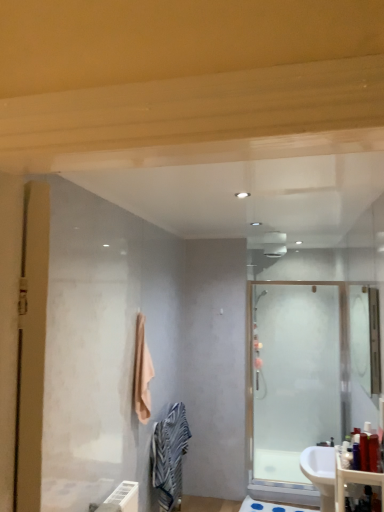
Locate an element on the screen. Image resolution: width=384 pixels, height=512 pixels. beige cotton towel at center-left, the second bath towel in the back-to-front sequence is located at coordinates (142, 373).

Describe the element at coordinates (296, 384) in the screenshot. I see `frosted glass shower door at right` at that location.

Locate an element on the screen. The width and height of the screenshot is (384, 512). blue rubber bath mat at lower center is located at coordinates (269, 507).

This screenshot has width=384, height=512. What do you see at coordinates (169, 456) in the screenshot?
I see `striped cotton bath towel at lower center, the second bath towel in the top-to-bottom sequence` at bounding box center [169, 456].

The width and height of the screenshot is (384, 512). What are the coordinates of `striped cotton bath towel at lower center, marked as the 1th bath towel in a bottom-to-top arrangement` in the screenshot? It's located at (169, 456).

The image size is (384, 512). I want to click on beige cotton towel at center-left, the 1th bath towel in the top-to-bottom sequence, so click(142, 373).

From the image's perspective, which one is positioned higher, striped cotton bath towel at lower center, the second bath towel in the top-to-bottom sequence, or white glossy sink at lower right?

From the image's view, white glossy sink at lower right is above.

Is striped cotton bath towel at lower center, which is the second bath towel from front to back, aimed at white glossy sink at lower right?

Yes, striped cotton bath towel at lower center, which is the second bath towel from front to back, is facing white glossy sink at lower right.

Considering the sizes of objects striped cotton bath towel at lower center, which is the second bath towel from front to back, and white glossy sink at lower right in the image provided, who is smaller, striped cotton bath towel at lower center, which is the second bath towel from front to back, or white glossy sink at lower right?

striped cotton bath towel at lower center, which is the second bath towel from front to back.

Considering the relative positions of striped cotton bath towel at lower center, placed as the 1th bath towel when sorted from back to front, and white glossy sink at lower right in the image provided, is striped cotton bath towel at lower center, placed as the 1th bath towel when sorted from back to front, to the left or to the right of white glossy sink at lower right?

Based on their positions, striped cotton bath towel at lower center, placed as the 1th bath towel when sorted from back to front, is located to the left of white glossy sink at lower right.

Is point (341, 462) closer or farther from the camera than point (376, 459)?

Clearly, point (341, 462) is more distant from the camera than point (376, 459).

Is translucent plastic bottle at lower right, which is the fourth toiletry from right to left, aimed at translucent plastic bottle at lower right, the first toiletry viewed from the right?

No, translucent plastic bottle at lower right, which is the fourth toiletry from right to left, is not aimed at translucent plastic bottle at lower right, the first toiletry viewed from the right.

Who is taller, translucent plastic bottle at lower right, the first toiletry viewed from the left, or translucent plastic bottle at lower right, the fourth toiletry from the left?

translucent plastic bottle at lower right, the fourth toiletry from the left.

How many degrees apart are the facing directions of translucent plastic bottle at lower right, which is the fourth toiletry from right to left, and translucent plastic bottle at lower right, the fourth toiletry from the left?

The angle between the facing direction of translucent plastic bottle at lower right, which is the fourth toiletry from right to left, and the facing direction of translucent plastic bottle at lower right, the fourth toiletry from the left, is 2.13 degrees.

Is white glossy sink at lower right taller or shorter than matte plastic counter top at lower right?

In the image, white glossy sink at lower right appears to be taller than matte plastic counter top at lower right.

Is the depth of white glossy sink at lower right less than that of matte plastic counter top at lower right?

No, it is behind matte plastic counter top at lower right.

Is point (320, 478) closer or farther from the camera than point (335, 477)?

Point (320, 478) is farther from the camera than point (335, 477).

Choose the correct answer: Is white glossy sink at lower right inside matte plastic counter top at lower right or outside it?

white glossy sink at lower right is not inside matte plastic counter top at lower right, it's outside.

From the picture: Which object is closer to the camera taking this photo, translucent plastic bottle at lower right, the fourth toiletry from the left, or clear glass mirror at upper right?

Positioned in front is translucent plastic bottle at lower right, the fourth toiletry from the left.

From the image's perspective, between translucent plastic bottle at lower right, the fourth toiletry from the left, and clear glass mirror at upper right, who is located below?

translucent plastic bottle at lower right, the fourth toiletry from the left, from the image's perspective.

Considering the positions of points (370, 453) and (379, 347), is point (370, 453) closer to camera compared to point (379, 347)?

Yes.

Are translucent plastic bottle at lower right, the first toiletry viewed from the right, and clear glass mirror at upper right making contact?

No, translucent plastic bottle at lower right, the first toiletry viewed from the right, is not with clear glass mirror at upper right.

What are the coordinates of `bath towel directly beneath the translucent plastic bottle at right, which appears as the third toiletry when viewed from the right (from a real-world perspective)` in the screenshot? It's located at (169, 456).

From a real-world perspective, relative to translucent plastic bottle at right, the 2th toiletry positioned from the left, is striped cotton bath towel at lower center, marked as the 1th bath towel in a bottom-to-top arrangement, vertically above or below?

striped cotton bath towel at lower center, marked as the 1th bath towel in a bottom-to-top arrangement, is below translucent plastic bottle at right, the 2th toiletry positioned from the left.

Does striped cotton bath towel at lower center, placed as the 1th bath towel when sorted from back to front, turn towards translucent plastic bottle at right, which appears as the third toiletry when viewed from the right?

No, striped cotton bath towel at lower center, placed as the 1th bath towel when sorted from back to front, is not aimed at translucent plastic bottle at right, which appears as the third toiletry when viewed from the right.

Is striped cotton bath towel at lower center, which is the second bath towel from front to back, in front of or behind translucent plastic bottle at right, which appears as the third toiletry when viewed from the right, in the image?

striped cotton bath towel at lower center, which is the second bath towel from front to back, is behind translucent plastic bottle at right, which appears as the third toiletry when viewed from the right.

Based on the photo, could you measure the distance between frosted glass shower door at right and beige cotton towel at center-left, the second bath towel in the back-to-front sequence?

They are 1.91 meters apart.

From the image's perspective, is frosted glass shower door at right above or below beige cotton towel at center-left, the second bath towel in the back-to-front sequence?

frosted glass shower door at right is situated lower than beige cotton towel at center-left, the second bath towel in the back-to-front sequence, in the image.

Considering the points (262, 411) and (136, 376), which point is in front, point (262, 411) or point (136, 376)?

The point (136, 376) is closer to the camera.

What's the angular difference between frosted glass shower door at right and beige cotton towel at center-left, the first bath towel from the front,'s facing directions?

95.1 degrees separate the facing orientations of frosted glass shower door at right and beige cotton towel at center-left, the first bath towel from the front.

Is translucent plastic bottle at lower right, the first toiletry viewed from the left, outside of translucent plastic bottle at right, which ranks as the 2th toiletry in right-to-left order?

Yes, translucent plastic bottle at lower right, the first toiletry viewed from the left, is not within translucent plastic bottle at right, which ranks as the 2th toiletry in right-to-left order.

Consider the image. Which of these two, translucent plastic bottle at lower right, the first toiletry viewed from the left, or translucent plastic bottle at right, which ranks as the 2th toiletry in right-to-left order, is thinner?

Thinner between the two is translucent plastic bottle at right, which ranks as the 2th toiletry in right-to-left order.

From a real-world perspective, is translucent plastic bottle at lower right, which is the fourth toiletry from right to left, located higher than translucent plastic bottle at right, the third toiletry viewed from the left?

No, from a real-world perspective, translucent plastic bottle at lower right, which is the fourth toiletry from right to left, is not over translucent plastic bottle at right, the third toiletry viewed from the left

Considering the relative sizes of translucent plastic bottle at lower right, which is the fourth toiletry from right to left, and translucent plastic bottle at right, which ranks as the 2th toiletry in right-to-left order, in the image provided, is translucent plastic bottle at lower right, which is the fourth toiletry from right to left, bigger than translucent plastic bottle at right, which ranks as the 2th toiletry in right-to-left order,?

Actually, translucent plastic bottle at lower right, which is the fourth toiletry from right to left, might be smaller than translucent plastic bottle at right, which ranks as the 2th toiletry in right-to-left order.

Starting from the white glossy sink at lower right, which bath towel is the 1st one to the left? Please provide its 2D coordinates.

[(169, 456)]

Which toiletry is the 3rd one when counting from the right side of the translucent plastic bottle at lower right, which is the fourth toiletry from right to left? Please provide its 2D coordinates.

[(373, 452)]

Based on their spatial positions, is clear glass mirror at upper right or striped cotton bath towel at lower center, placed as the 1th bath towel when sorted from back to front, further from matte plastic counter top at lower right?

The object further to matte plastic counter top at lower right is clear glass mirror at upper right.

Looking at the image, which one is located closer to striped cotton bath towel at lower center, placed as the 1th bath towel when sorted from back to front, translucent plastic bottle at lower right, the fourth toiletry from the left, or matte plastic counter top at lower right?

The object closer to striped cotton bath towel at lower center, placed as the 1th bath towel when sorted from back to front, is matte plastic counter top at lower right.

Which object lies further to the anchor point translucent plastic bottle at right, the 2th toiletry positioned from the left, striped cotton bath towel at lower center, placed as the 1th bath towel when sorted from back to front, or translucent plastic bottle at lower right, the first toiletry viewed from the left?

striped cotton bath towel at lower center, placed as the 1th bath towel when sorted from back to front, is positioned further to the anchor translucent plastic bottle at right, the 2th toiletry positioned from the left.

Considering their positions, is clear glass mirror at upper right positioned further to translucent plastic bottle at right, which ranks as the 2th toiletry in right-to-left order, than blue rubber bath mat at lower center?

clear glass mirror at upper right is further to translucent plastic bottle at right, which ranks as the 2th toiletry in right-to-left order.

When comparing their distances from blue rubber bath mat at lower center, does beige cotton towel at center-left, the first bath towel from the front, or matte plastic counter top at lower right seem closer?

Among the two, beige cotton towel at center-left, the first bath towel from the front, is located nearer to blue rubber bath mat at lower center.

Based on the photo, based on their spatial positions, is white glossy sink at lower right or translucent plastic bottle at right, which ranks as the 2th toiletry in right-to-left order, closer to translucent plastic bottle at lower right, the first toiletry viewed from the left?

Based on the image, translucent plastic bottle at right, which ranks as the 2th toiletry in right-to-left order, appears to be nearer to translucent plastic bottle at lower right, the first toiletry viewed from the left.

Estimate the real-world distances between objects in this image. Which object is further from matte plastic counter top at lower right, translucent plastic bottle at lower right, which is the fourth toiletry from right to left, or beige cotton towel at center-left, the first bath towel from the front?

The object further to matte plastic counter top at lower right is beige cotton towel at center-left, the first bath towel from the front.

Looking at the image, which one is located further to frosted glass shower door at right, translucent plastic bottle at right, the third toiletry viewed from the left, or translucent plastic bottle at right, the 2th toiletry positioned from the left?

The object further to frosted glass shower door at right is translucent plastic bottle at right, the third toiletry viewed from the left.

Where is `screen door situated between beige cotton towel at center-left, the 1th bath towel in the top-to-bottom sequence, and clear glass mirror at upper right from left to right`? The height and width of the screenshot is (512, 384). screen door situated between beige cotton towel at center-left, the 1th bath towel in the top-to-bottom sequence, and clear glass mirror at upper right from left to right is located at coordinates (296, 384).

Where is `sink between translucent plastic bottle at right, the third toiletry viewed from the left, and frosted glass shower door at right from front to back`? This screenshot has width=384, height=512. sink between translucent plastic bottle at right, the third toiletry viewed from the left, and frosted glass shower door at right from front to back is located at coordinates (321, 473).

Image resolution: width=384 pixels, height=512 pixels. I want to click on sink between striped cotton bath towel at lower center, which is the second bath towel from front to back, and clear glass mirror at upper right, so click(x=321, y=473).

Identify the location of counter top between translucent plastic bottle at lower right, which is the fourth toiletry from right to left, and white glossy sink at lower right, in the vertical direction. This screenshot has height=512, width=384. click(x=353, y=482).